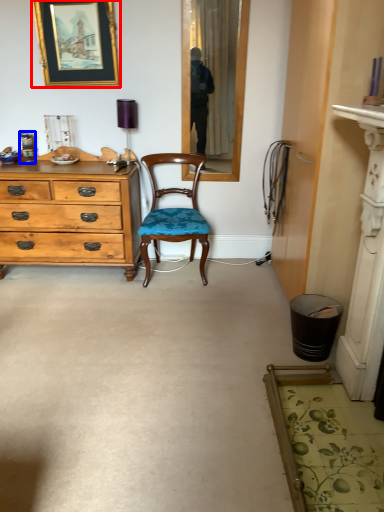
Question: Which of the following is the closest to the observer, picture frame (highlighted by a red box) or bottle (highlighted by a blue box)?

Choices:
 (A) picture frame
 (B) bottle

Answer: (A)